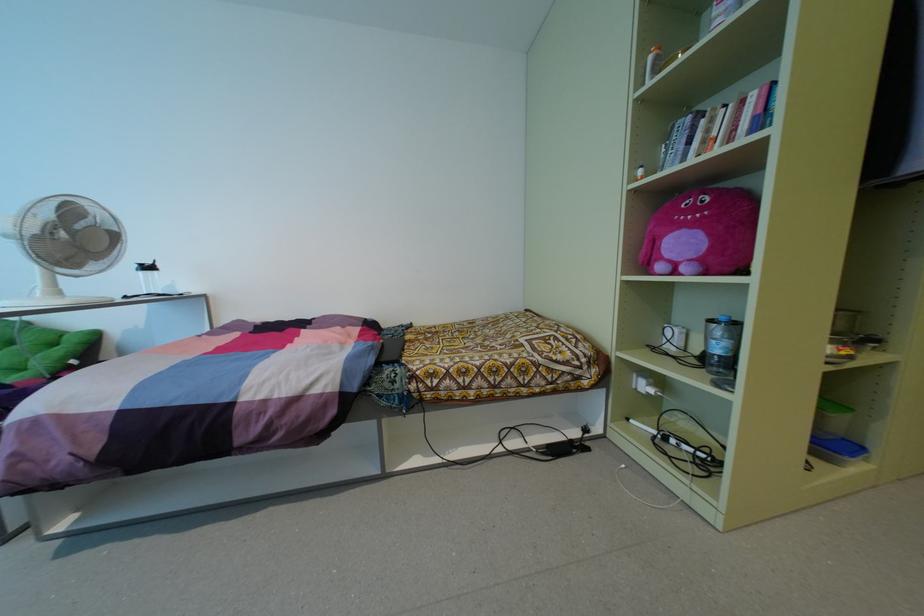
Find the location of `chair sitting surface`. chair sitting surface is located at coordinates (34, 362).